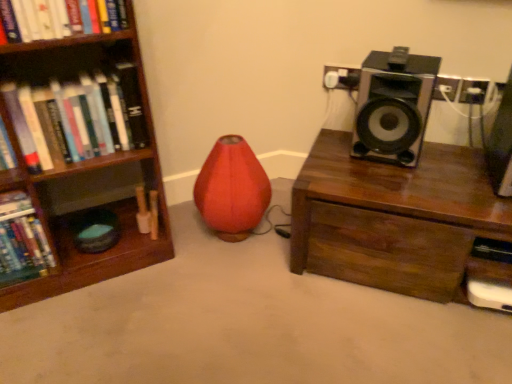
Question: From a real-world perspective, is matte red bean bag chair at center positioned under brown wooden chest at right based on gravity?

Choices:
 (A) yes
 (B) no

Answer: (B)

Question: From a real-world perspective, does matte red bean bag chair at center stand above brown wooden chest at right?

Choices:
 (A) yes
 (B) no

Answer: (A)

Question: Can you confirm if matte red bean bag chair at center is thinner than brown wooden chest at right?

Choices:
 (A) no
 (B) yes

Answer: (B)

Question: Is matte red bean bag chair at center positioned behind brown wooden chest at right?

Choices:
 (A) no
 (B) yes

Answer: (B)

Question: Can you confirm if matte red bean bag chair at center is taller than brown wooden chest at right?

Choices:
 (A) yes
 (B) no

Answer: (A)

Question: Does matte red bean bag chair at center appear on the right side of brown wooden chest at right?

Choices:
 (A) no
 (B) yes

Answer: (A)

Question: Considering the relative sizes of metallic silver speaker at upper right, which is the 1th speaker from right to left, and hardcover book at left, arranged as the first book when ordered from the bottom, in the image provided, is metallic silver speaker at upper right, which is the 1th speaker from right to left, wider than hardcover book at left, arranged as the first book when ordered from the bottom,?

Choices:
 (A) yes
 (B) no

Answer: (A)

Question: Is metallic silver speaker at upper right, which is the 1th speaker from right to left, outside of hardcover book at left, placed as the 2th book when sorted from top to bottom?

Choices:
 (A) yes
 (B) no

Answer: (A)

Question: Does metallic silver speaker at upper right, which ranks as the 2th speaker in left-to-right order, have a larger size compared to hardcover book at left, which is the second book from right to left?

Choices:
 (A) no
 (B) yes

Answer: (B)

Question: Is metallic silver speaker at upper right, which is the 1th speaker from right to left, looking in the opposite direction of hardcover book at left, which is the second book from right to left?

Choices:
 (A) yes
 (B) no

Answer: (B)

Question: Considering the relative positions of metallic silver speaker at upper right, which is the 1th speaker from right to left, and hardcover book at left, placed as the 2th book when sorted from top to bottom, in the image provided, is metallic silver speaker at upper right, which is the 1th speaker from right to left, behind hardcover book at left, placed as the 2th book when sorted from top to bottom,?

Choices:
 (A) no
 (B) yes

Answer: (A)

Question: Does metallic silver speaker at upper right, which is the 1th speaker from right to left, appear on the right side of hardcover book at left, the first book in the left-to-right sequence?

Choices:
 (A) yes
 (B) no

Answer: (A)

Question: From a real-world perspective, does hardcover book at left, the first book in the left-to-right sequence, stand above black plastic speaker at upper right, which ranks as the 1th speaker in left-to-right order?

Choices:
 (A) no
 (B) yes

Answer: (A)